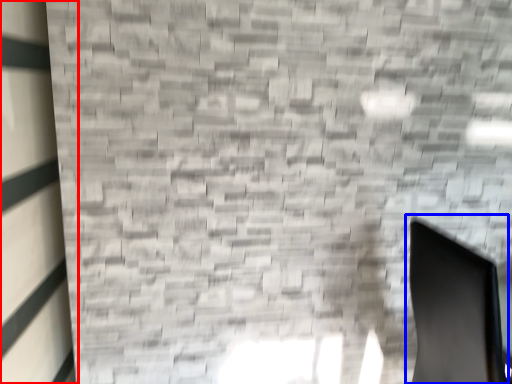
Question: Which point is closer to the camera, window (highlighted by a red box) or swivel chair (highlighted by a blue box)?

Choices:
 (A) window
 (B) swivel chair

Answer: (A)